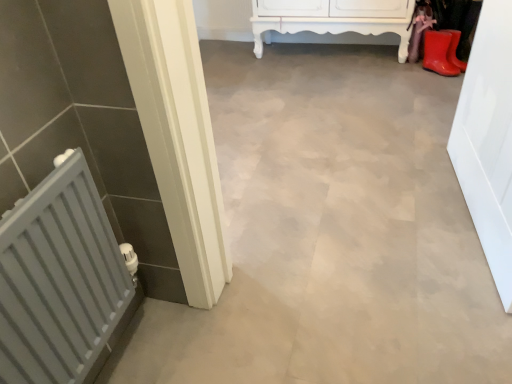
Question: In terms of height, does rubber matte boot at upper right look taller or shorter compared to white glossy cabinet at upper center?

Choices:
 (A) tall
 (B) short

Answer: (B)

Question: Do you think rubber matte boot at upper right is within white glossy cabinet at upper center, or outside of it?

Choices:
 (A) inside
 (B) outside

Answer: (B)

Question: Which is farther from the white glossy cabinet at upper center?

Choices:
 (A) white glossy door at right
 (B) rubber matte boot at upper right
 (C) gray matte radiator at left

Answer: (C)

Question: Estimate the real-world distances between objects in this image. Which object is farther from the rubber matte boot at upper right?

Choices:
 (A) white glossy door at right
 (B) gray matte radiator at left
 (C) white glossy cabinet at upper center

Answer: (B)